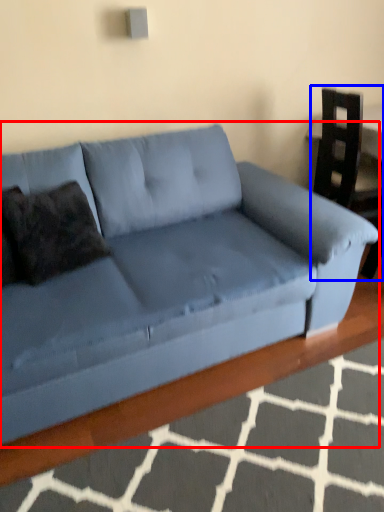
Question: Among these objects, which one is nearest to the camera, studio couch (highlighted by a red box) or armchair (highlighted by a blue box)?

Choices:
 (A) studio couch
 (B) armchair

Answer: (A)